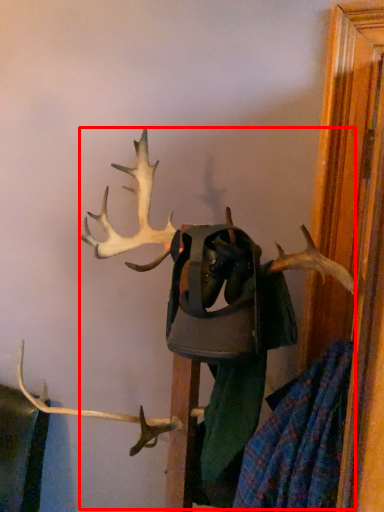
Question: In this image, where is deer (annotated by the red box) located relative to clothing?

Choices:
 (A) right
 (B) left

Answer: (B)